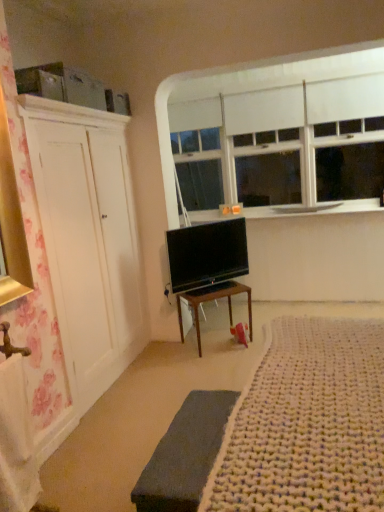
Question: From the image's perspective, is white smooth window sill at upper center above white knitted rug at lower right?

Choices:
 (A) yes
 (B) no

Answer: (A)

Question: Is white smooth window sill at upper center shorter than white knitted rug at lower right?

Choices:
 (A) no
 (B) yes

Answer: (B)

Question: Is white smooth window sill at upper center with white knitted rug at lower right?

Choices:
 (A) yes
 (B) no

Answer: (B)

Question: Is white smooth window sill at upper center not within white knitted rug at lower right?

Choices:
 (A) no
 (B) yes

Answer: (B)

Question: Could you tell me if white smooth window sill at upper center is facing white knitted rug at lower right?

Choices:
 (A) no
 (B) yes

Answer: (A)

Question: Considering the relative sizes of white smooth window sill at upper center and white knitted rug at lower right in the image provided, is white smooth window sill at upper center taller than white knitted rug at lower right?

Choices:
 (A) no
 (B) yes

Answer: (A)

Question: Considering the relative sizes of white knitted rug at lower right and white smooth window sill at upper center in the image provided, is white knitted rug at lower right thinner than white smooth window sill at upper center?

Choices:
 (A) no
 (B) yes

Answer: (A)

Question: From the image's perspective, is white knitted rug at lower right over white smooth window sill at upper center?

Choices:
 (A) yes
 (B) no

Answer: (B)

Question: Is the position of white knitted rug at lower right less distant than that of white smooth window sill at upper center?

Choices:
 (A) no
 (B) yes

Answer: (B)

Question: Considering the relative positions of white knitted rug at lower right and white smooth window sill at upper center in the image provided, is white knitted rug at lower right to the left of white smooth window sill at upper center from the viewer's perspective?

Choices:
 (A) yes
 (B) no

Answer: (A)

Question: Is white knitted rug at lower right facing away from white smooth window sill at upper center?

Choices:
 (A) no
 (B) yes

Answer: (A)

Question: Does white knitted rug at lower right turn towards white smooth window sill at upper center?

Choices:
 (A) no
 (B) yes

Answer: (A)

Question: Is the position of white matte window at upper center more distant than that of wooden desk at center?

Choices:
 (A) yes
 (B) no

Answer: (A)